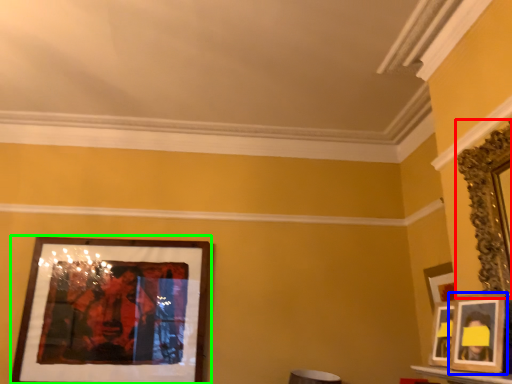
Question: Considering the real-world distances, which object is farthest from picture frame (highlighted by a red box)? picture frame (highlighted by a blue box) or picture frame (highlighted by a green box)?

Choices:
 (A) picture frame
 (B) picture frame

Answer: (B)